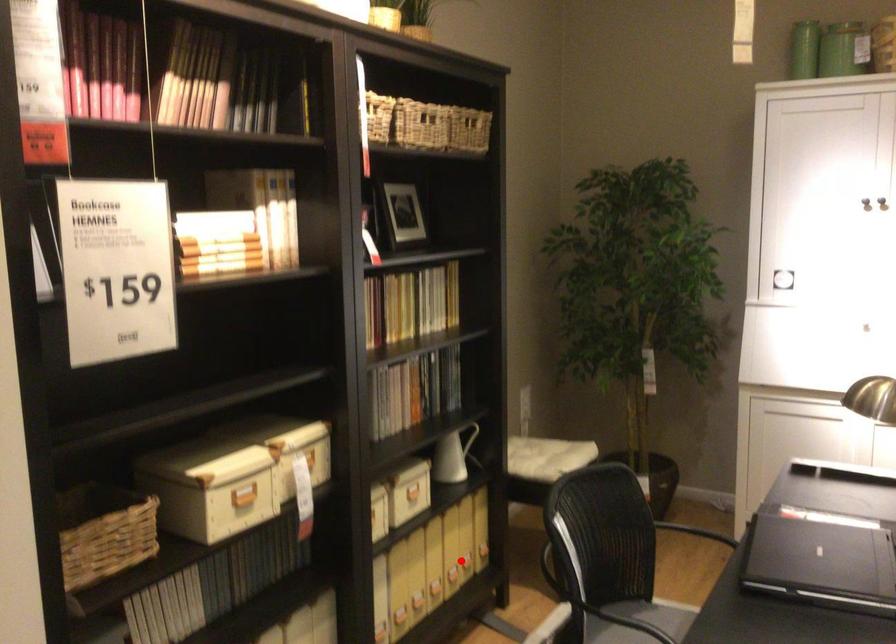
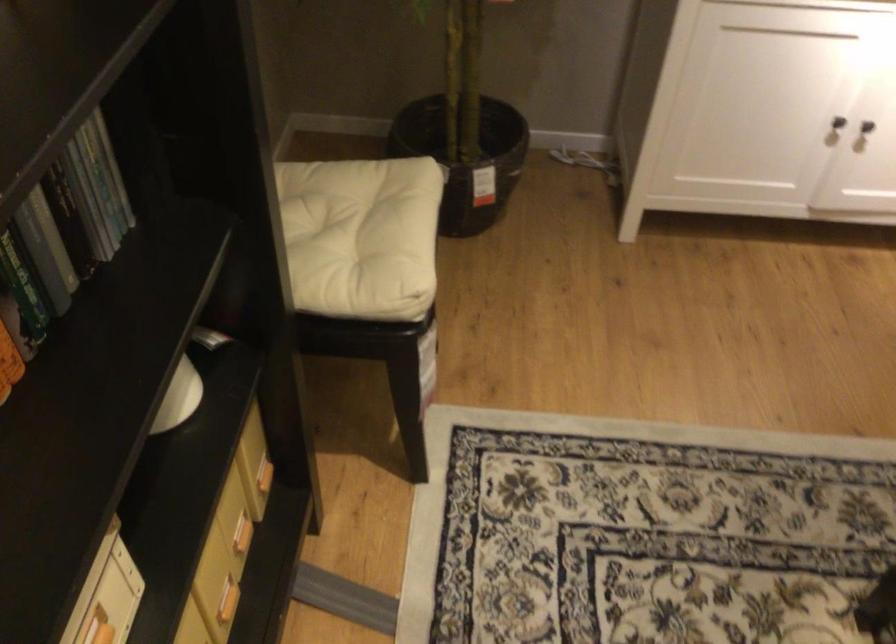
In the second image, find the point that corresponds to the highlighted location in the first image.

(240, 534)